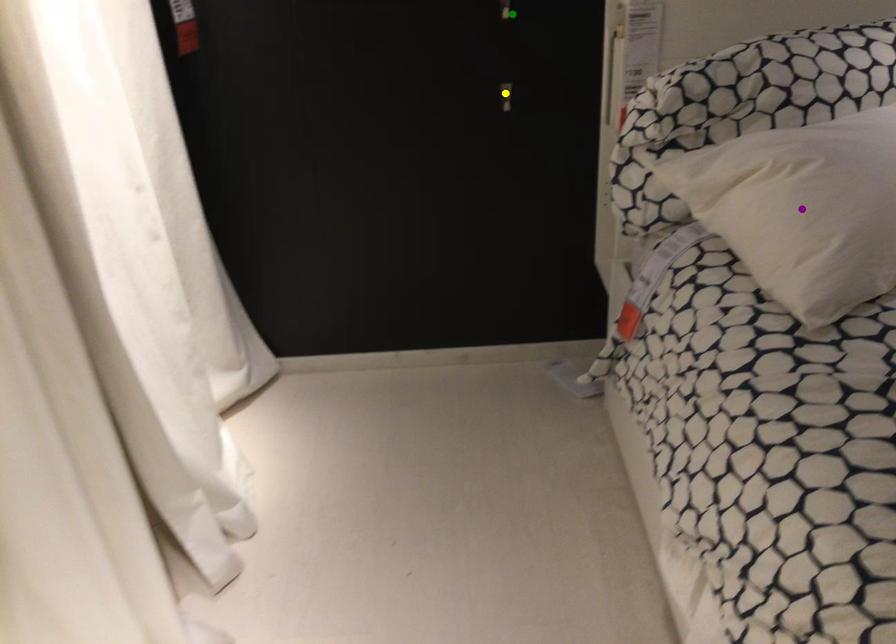
Based on the photo, order these from farthest to nearest:
1. green point
2. purple point
3. yellow point

yellow point, green point, purple point